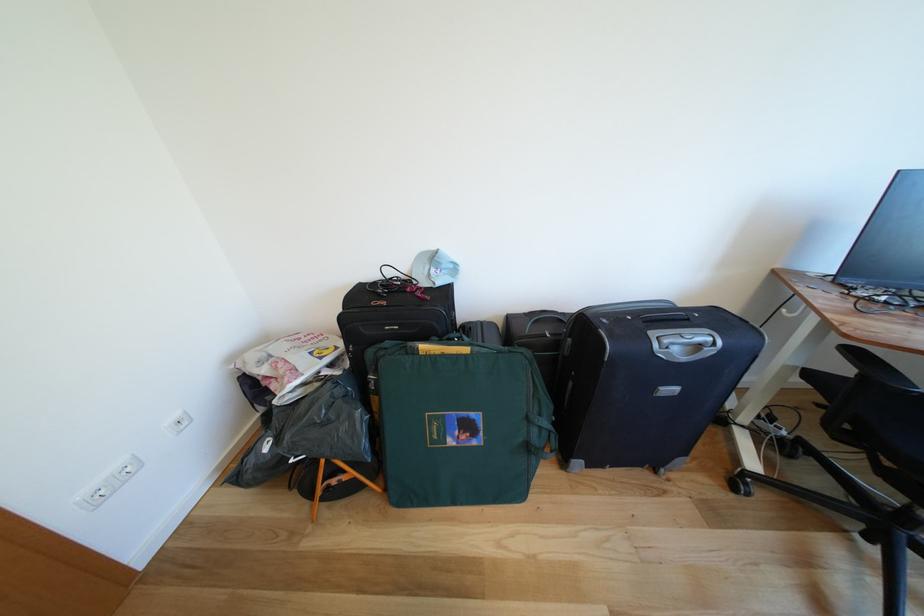
What are the coordinates of `white wall outlet` in the screenshot? It's located at (95, 495).